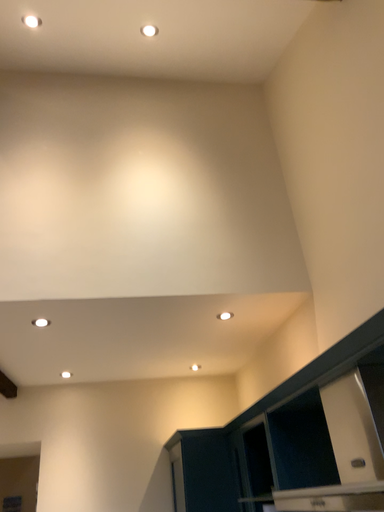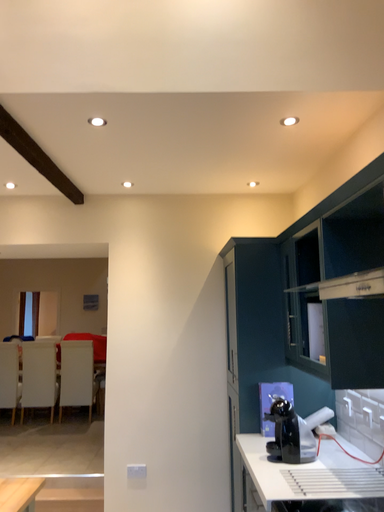
Question: Which way did the camera rotate in the video?

Choices:
 (A) rotated right
 (B) rotated left

Answer: (B)